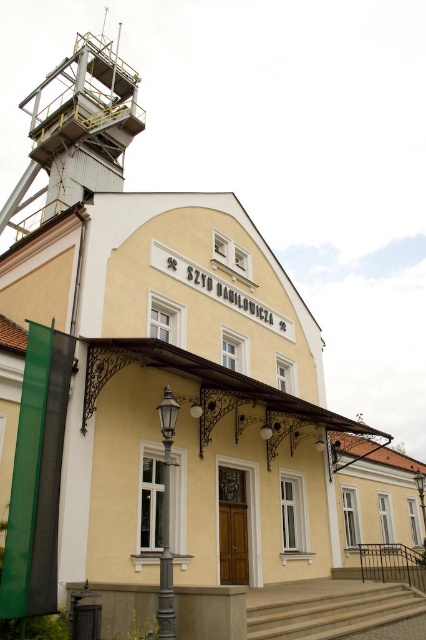
You are standing at the entrance of the building and want to reach the point labeled as point (339, 608). Which direction should you move relative to point (92, 141)?

Since point (92, 141) is behind point (339, 608), you should move forward towards point (339, 608) away from point (92, 141).

You are standing at the entrance of the building and looking towards the yellow metallic tower at upper left located at point (77,129). Can you see the tower from your current position?

Yes, the yellow metallic tower at upper left is located at point (77,129), which is visible from the entrance.